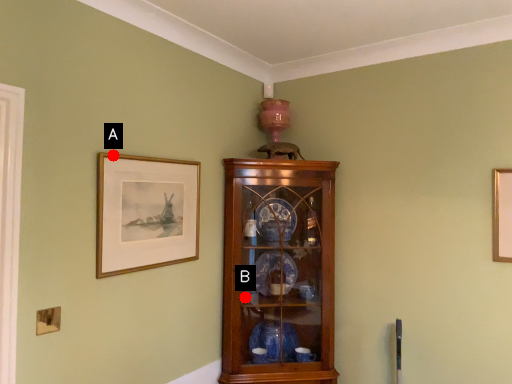
Question: Two points are circled on the image, labeled by A and B beside each circle. Which point is further to the camera?

Choices:
 (A) A is further
 (B) B is further

Answer: (B)